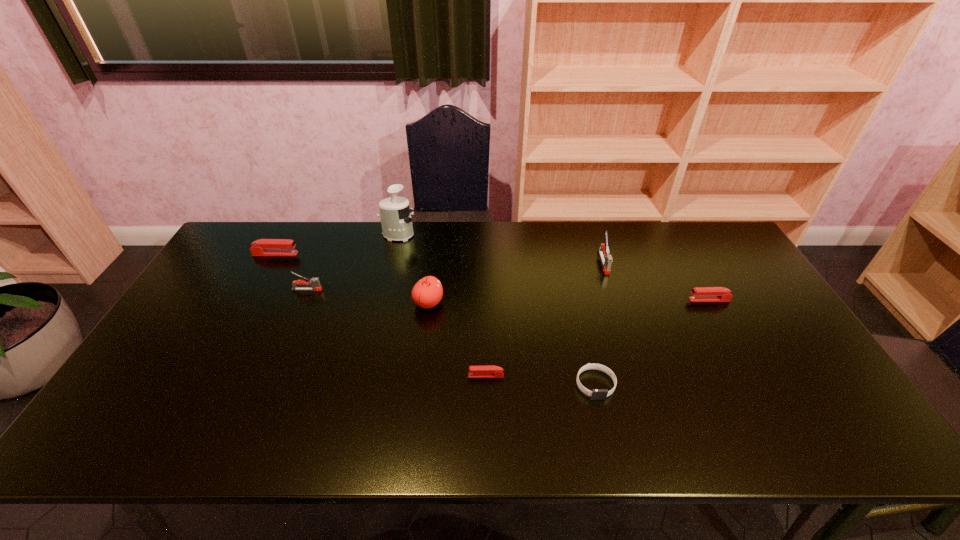
This screenshot has width=960, height=540. In order to click on vacant space situated 0.060m on the front-facing side of the second biggest red stapler in this screenshot , I will do `click(669, 300)`.

Identify the location of blank area located 0.260m on the front-facing side of the second biggest red stapler. (602, 300).

This screenshot has width=960, height=540. I want to click on vacant space located on the front-facing side of the second biggest red stapler, so click(609, 300).

Find the location of a particular element. free space located 0.080m on the outer surface of the sixth object from left to right is located at coordinates coord(606,431).

Locate an element on the screen. blank space located 0.210m on the front-facing side of the smallest red stapler is located at coordinates (386, 375).

Find the location of `vacant space located on the front-facing side of the smallest red stapler`. vacant space located on the front-facing side of the smallest red stapler is located at coordinates (311, 375).

I want to click on vacant space located on the front-facing side of the smallest red stapler, so click(x=409, y=375).

Where is `juicer situated at the far edge`? The image size is (960, 540). juicer situated at the far edge is located at coordinates (396, 221).

Identify the location of object present at the left edge. (263, 247).

Identify the location of object present at the right edge. The height and width of the screenshot is (540, 960). [x=699, y=294].